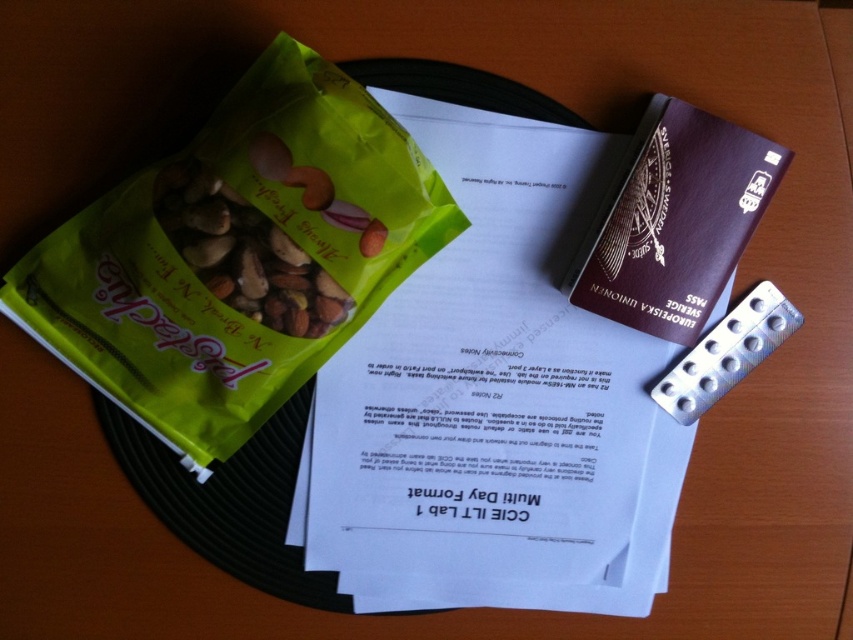
Which is in front, point (82, 246) or point (679, 289)?

Point (82, 246)

Find the location of a particular element. This screenshot has width=853, height=640. green matte snack packet at left is located at coordinates (236, 256).

Where is `green matte snack packet at left`? This screenshot has height=640, width=853. green matte snack packet at left is located at coordinates (236, 256).

Between green matte snack packet at left and green matte snack mix at center, which one is positioned lower?

green matte snack packet at left is lower down.

Is point (231, 99) more distant than point (173, 228)?

That is True.

This screenshot has height=640, width=853. In order to click on green matte snack packet at left in this screenshot , I will do point(236,256).

Who is shorter, brown leather passport at upper right or green matte snack mix at center?

green matte snack mix at center

From the picture: Who is higher up, brown leather passport at upper right or green matte snack mix at center?

Positioned higher is brown leather passport at upper right.

Between point (631, 317) and point (194, 204), which one is positioned in front?

Positioned in front is point (194, 204).

Where is `brown leather passport at upper right`? The width and height of the screenshot is (853, 640). brown leather passport at upper right is located at coordinates (674, 220).